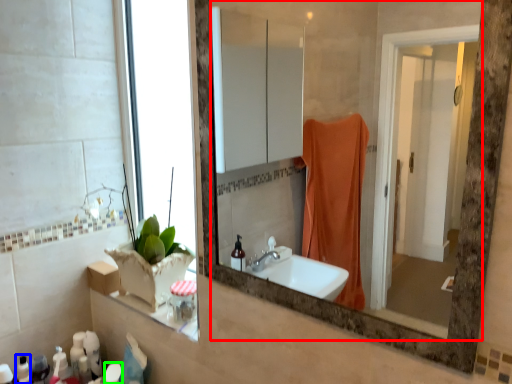
Question: Estimate the real-world distances between objects in this image. Which object is farther from mirror (highlighted by a red box), toiletry (highlighted by a blue box) or toiletry (highlighted by a green box)?

Choices:
 (A) toiletry
 (B) toiletry

Answer: (A)